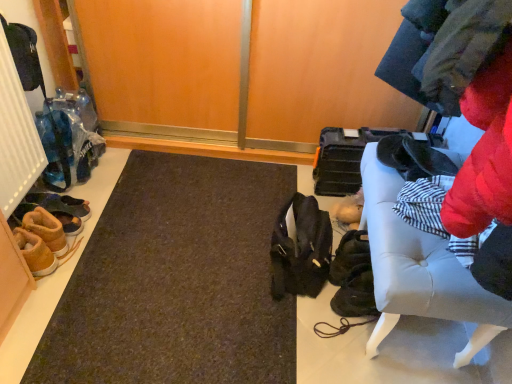
The height and width of the screenshot is (384, 512). What do you see at coordinates (60, 204) in the screenshot?
I see `leather sandal at left, which is counted as the 1th footwear, starting from the back` at bounding box center [60, 204].

The width and height of the screenshot is (512, 384). Describe the element at coordinates (69, 218) in the screenshot. I see `brown suede shoes at lower left, the 3th footwear in the front-to-back sequence` at that location.

Where is `tan suede boot at lower left, arranged as the first footwear when viewed from the front`? This screenshot has height=384, width=512. tan suede boot at lower left, arranged as the first footwear when viewed from the front is located at coordinates (35, 253).

Is white leather bench at right surrounding tan suede boot at lower left, marked as the fourth footwear in a back-to-front arrangement?

No, tan suede boot at lower left, marked as the fourth footwear in a back-to-front arrangement, is not a part of white leather bench at right.

Between white leather bench at right and tan suede boot at lower left, marked as the fourth footwear in a back-to-front arrangement, which one has larger size?

white leather bench at right.

Is white leather bench at right facing towards tan suede boot at lower left, marked as the fourth footwear in a back-to-front arrangement?

Yes, white leather bench at right is oriented towards tan suede boot at lower left, marked as the fourth footwear in a back-to-front arrangement.

Relative to tan suede boot at lower left, marked as the fourth footwear in a back-to-front arrangement, is white leather bench at right in front or behind?

Clearly, white leather bench at right is in front of tan suede boot at lower left, marked as the fourth footwear in a back-to-front arrangement.

Looking at their sizes, would you say white leather bench at right is wider or thinner than matte black shoulder bag at center?

Considering their sizes, white leather bench at right looks broader than matte black shoulder bag at center.

From the picture: Does white leather bench at right come in front of matte black shoulder bag at center?

Yes, it is in front of matte black shoulder bag at center.

Which is further, (412,262) or (306,226)?

Positioned behind is point (306,226).

From the picture: How far apart are white leather bench at right and matte black shoulder bag at center?

white leather bench at right and matte black shoulder bag at center are 12.96 inches apart from each other.

How distant is leather sandal at left, which is counted as the 1th footwear, starting from the back, from matte black shoulder bag at center?

leather sandal at left, which is counted as the 1th footwear, starting from the back, and matte black shoulder bag at center are 34.72 inches apart from each other.

From a real-world perspective, relative to matte black shoulder bag at center, is leather sandal at left, acting as the 4th footwear starting from the front, vertically above or below?

leather sandal at left, acting as the 4th footwear starting from the front, is situated lower than matte black shoulder bag at center in the real world.

In the scene shown: From the image's perspective, between leather sandal at left, acting as the 4th footwear starting from the front, and matte black shoulder bag at center, who is located below?

matte black shoulder bag at center is shown below in the image.

Considering the points (48, 202) and (274, 277), which point is behind, point (48, 202) or point (274, 277)?

Positioned behind is point (48, 202).

Which object is closer to the camera, brown suede shoes at lower left, which ranks as the 2th footwear in back-to-front order, or white leather bench at right?

Positioned in front is white leather bench at right.

From a real-world perspective, which is physically below, brown suede shoes at lower left, the 3th footwear in the front-to-back sequence, or white leather bench at right?

brown suede shoes at lower left, the 3th footwear in the front-to-back sequence.

Which object is positioned more to the right, brown suede shoes at lower left, which ranks as the 2th footwear in back-to-front order, or white leather bench at right?

white leather bench at right.

Can you confirm if brown suede shoes at lower left, which ranks as the 2th footwear in back-to-front order, is wider than white leather bench at right?

Incorrect, the width of brown suede shoes at lower left, which ranks as the 2th footwear in back-to-front order, does not surpass that of white leather bench at right.

Is matte black shoulder bag at center oriented towards leather sandal at left, which is counted as the 1th footwear, starting from the back?

Yes, matte black shoulder bag at center is facing leather sandal at left, which is counted as the 1th footwear, starting from the back.

Is point (329, 261) positioned behind point (77, 214)?

No, it is in front of (77, 214).

Does matte black shoulder bag at center have a lesser width compared to leather sandal at left, which is counted as the 1th footwear, starting from the back?

Yes.

How different are the orientations of matte black shoulder bag at center and leather sandal at left, acting as the 4th footwear starting from the front, in degrees?

178 degrees separate the facing orientations of matte black shoulder bag at center and leather sandal at left, acting as the 4th footwear starting from the front.

Does matte black shoulder bag at center have a lesser width compared to white leather bench at right?

Yes.

Looking at this image, considering the positions of objects matte black shoulder bag at center and white leather bench at right in the image provided, who is in front, matte black shoulder bag at center or white leather bench at right?

white leather bench at right is in front.

Does point (289, 293) come in front of point (382, 252)?

No, it is behind (382, 252).

Locate an element on the screen. This screenshot has width=512, height=384. shoulder bag located above the white leather bench at right (from the image's perspective) is located at coordinates (301, 249).

The image size is (512, 384). In order to click on furniture that appears on the right of tan suede boot at lower left, arranged as the first footwear when viewed from the front in this screenshot , I will do `click(420, 269)`.

Can you confirm if tan suede boot at lower left, marked as the fourth footwear in a back-to-front arrangement, is wider than white leather bench at right?

No.

Is tan suede boot at lower left, marked as the fourth footwear in a back-to-front arrangement, not within white leather bench at right?

Yes, tan suede boot at lower left, marked as the fourth footwear in a back-to-front arrangement, is not within white leather bench at right.

Does tan suede boot at lower left, marked as the fourth footwear in a back-to-front arrangement, have a greater height compared to white leather bench at right?

In fact, tan suede boot at lower left, marked as the fourth footwear in a back-to-front arrangement, may be shorter than white leather bench at right.

The image size is (512, 384). I want to click on footwear below the white leather bench at right (from the image's perspective), so click(35, 253).

What are the coordinates of `shoulder bag lying above the white leather bench at right (from the image's perspective)` in the screenshot? It's located at (301, 249).

Looking at this image, based on their spatial positions, is brown suede shoes at lower left, which ranks as the 2th footwear in back-to-front order, or white leather bench at right closer to matte black shoulder bag at center?

white leather bench at right is positioned closer to the anchor matte black shoulder bag at center.

In the scene shown: Considering their positions, is leather sandal at left, acting as the 4th footwear starting from the front, positioned closer to matte black shoulder bag at center than white leather bench at right?

white leather bench at right is positioned closer to the anchor matte black shoulder bag at center.

Considering their positions, is brown suede shoes at lower left, arranged as the second footwear when viewed from the front, positioned closer to tan suede boot at lower left, arranged as the first footwear when viewed from the front, than leather sandal at left, acting as the 4th footwear starting from the front?

brown suede shoes at lower left, arranged as the second footwear when viewed from the front, is positioned closer to the anchor tan suede boot at lower left, arranged as the first footwear when viewed from the front.

Estimate the real-world distances between objects in this image. Which object is closer to leather sandal at left, which is counted as the 1th footwear, starting from the back, brown suede shoes at lower left, the 3th footwear in the front-to-back sequence, or matte black shoulder bag at center?

brown suede shoes at lower left, the 3th footwear in the front-to-back sequence, lies closer to leather sandal at left, which is counted as the 1th footwear, starting from the back, than the other object.

When comparing their distances from white leather bench at right, does brown suede shoes at lower left, marked as the 3th footwear in a back-to-front arrangement, or matte black shoulder bag at center seem closer?

Among the two, matte black shoulder bag at center is located nearer to white leather bench at right.

From the image, which object appears to be nearer to brown suede shoes at lower left, the 3th footwear in the front-to-back sequence, brown suede shoes at lower left, arranged as the second footwear when viewed from the front, or matte black shoulder bag at center?

brown suede shoes at lower left, arranged as the second footwear when viewed from the front, is closer to brown suede shoes at lower left, the 3th footwear in the front-to-back sequence.

Which object lies further to the anchor point white leather bench at right, leather sandal at left, which is counted as the 1th footwear, starting from the back, or tan suede boot at lower left, marked as the fourth footwear in a back-to-front arrangement?

leather sandal at left, which is counted as the 1th footwear, starting from the back, lies further to white leather bench at right than the other object.

From the image, which object appears to be farther from white leather bench at right, brown suede shoes at lower left, which ranks as the 2th footwear in back-to-front order, or brown suede shoes at lower left, arranged as the second footwear when viewed from the front?

brown suede shoes at lower left, which ranks as the 2th footwear in back-to-front order, is further to white leather bench at right.

Image resolution: width=512 pixels, height=384 pixels. Find the location of `footwear located between brown suede shoes at lower left, which ranks as the 2th footwear in back-to-front order, and white leather bench at right in the left-right direction`. footwear located between brown suede shoes at lower left, which ranks as the 2th footwear in back-to-front order, and white leather bench at right in the left-right direction is located at coordinates (60, 204).

At what (x,y) coordinates should I click in order to perform the action: click on shoulder bag situated between leather sandal at left, acting as the 4th footwear starting from the front, and white leather bench at right from left to right. Please return your answer as a coordinate pair (x, y). Looking at the image, I should click on (301, 249).

The width and height of the screenshot is (512, 384). In order to click on shoulder bag situated between tan suede boot at lower left, arranged as the first footwear when viewed from the front, and white leather bench at right from left to right in this screenshot , I will do `click(301, 249)`.

You are a GUI agent. You are given a task and a screenshot of the screen. Output one action in this format:
    pyautogui.click(x=<x>, y=<y>)
    Task: Click on the shoulder bag between brown suede shoes at lower left, arranged as the second footwear when viewed from the front, and white leather bench at right, in the horizontal direction
    Image resolution: width=512 pixels, height=384 pixels.
    Given the screenshot: What is the action you would take?
    pyautogui.click(x=301, y=249)